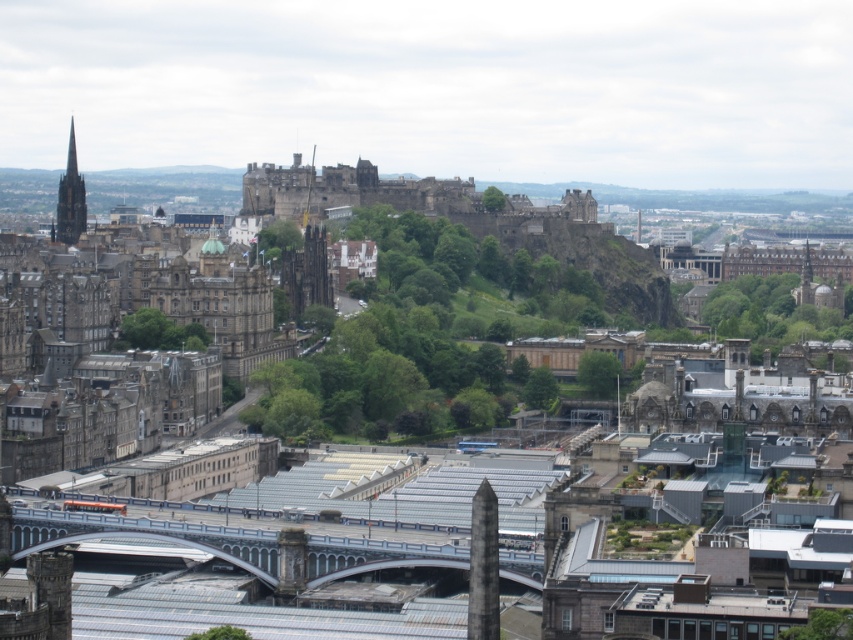
You are a tourist standing at the base of Edinburgh Castle. You see a metallic gray bridge at center and a dark gray stone spire at center. Which object is located above the other?

The metallic gray bridge at center is positioned under the dark gray stone spire at center, meaning the spire is above the bridge.

You are standing at the base of the hill looking up at Edinburgh Castle. You notice two points marked in the image, one at coordinates point [73,156] and the other at point [310,170]. Which point is higher up the hill?

Point [310,170] is higher up the hill than point [73,156] because it is further away from the camera, indicating a greater elevation.

Consider the image. You are standing at the base of the hill looking up at Edinburgh Castle. You notice two spires in the image. According to the scene, which spire is closer to you, the matte stone spire at left or the dark gray stone spire at center?

The matte stone spire at left is positioned under the dark gray stone spire at center, meaning the matte stone spire at left is closer to you.